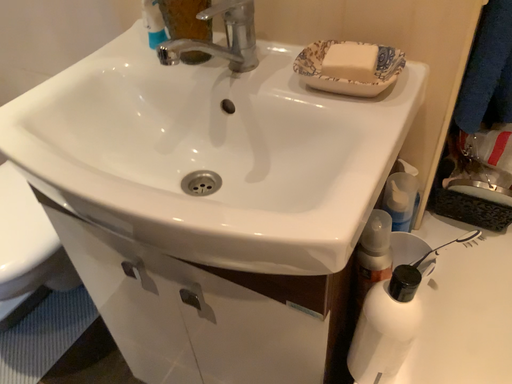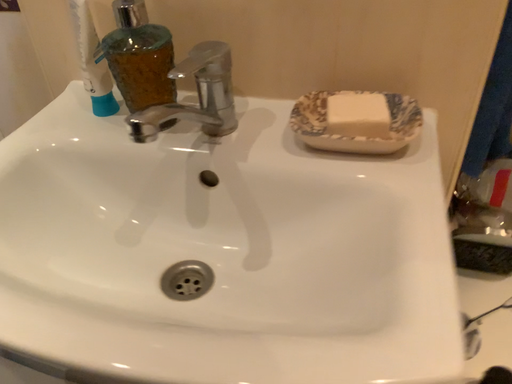
Question: How did the camera likely rotate when shooting the video?

Choices:
 (A) rotated downward
 (B) rotated upward

Answer: (B)